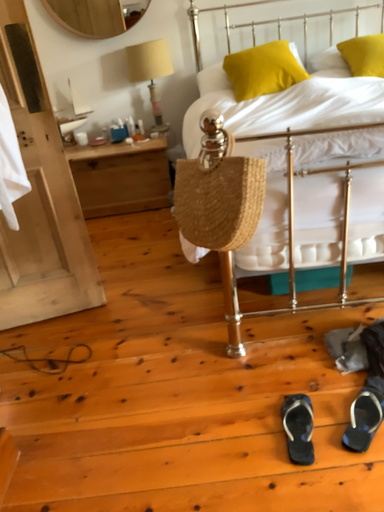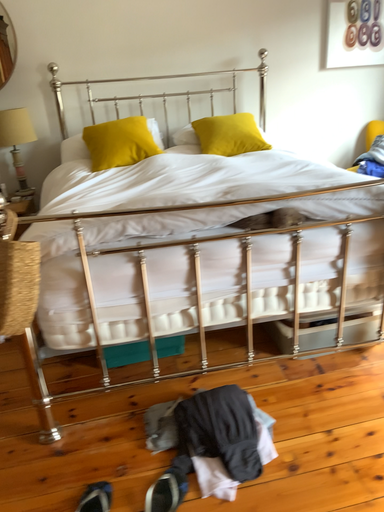
Question: Which way did the camera rotate in the video?

Choices:
 (A) rotated left
 (B) rotated right

Answer: (B)